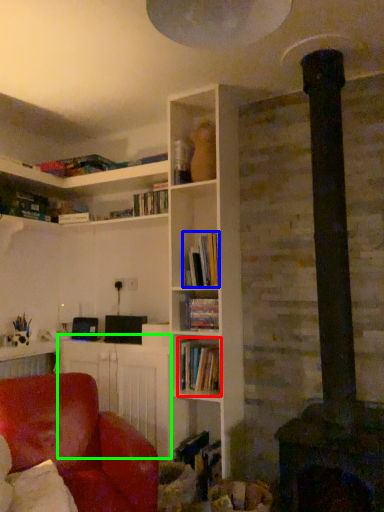
Question: Estimate the real-world distances between objects in this image. Which object is closer to book (highlighted by a red box), book (highlighted by a blue box) or table (highlighted by a green box)?

Choices:
 (A) book
 (B) table

Answer: (B)